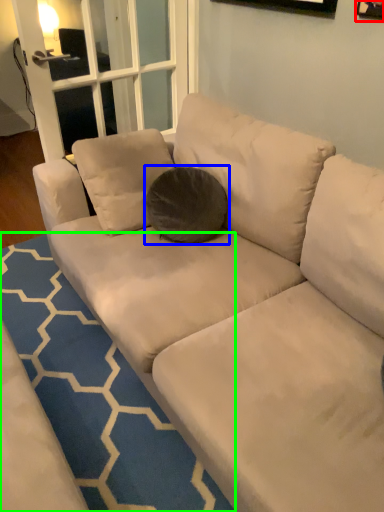
Question: Estimate the real-world distances between objects in this image. Which object is farther from picture frame (highlighted by a red box), throw pillow (highlighted by a blue box) or doormat (highlighted by a green box)?

Choices:
 (A) throw pillow
 (B) doormat

Answer: (B)